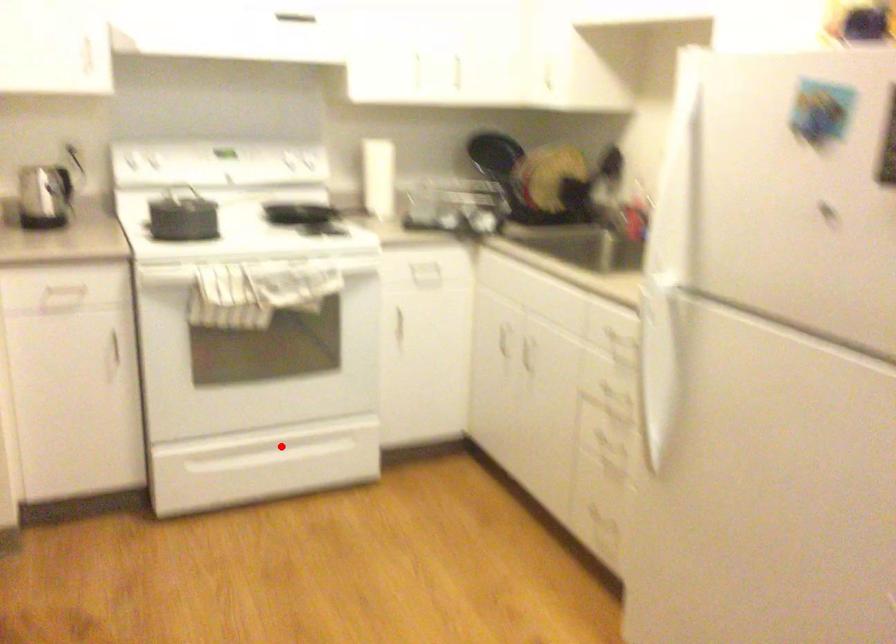
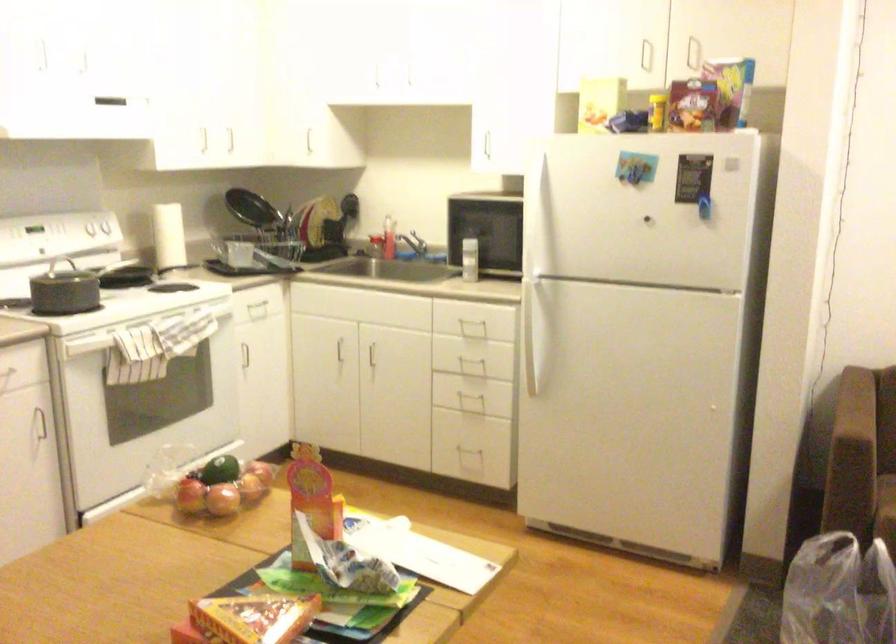
Question: I am providing you with two images of the same scene from different viewpoints. A red point is marked on the first image. Is the red point's position out of view in image 2?

Choices:
 (A) Yes
 (B) No

Answer: (A)